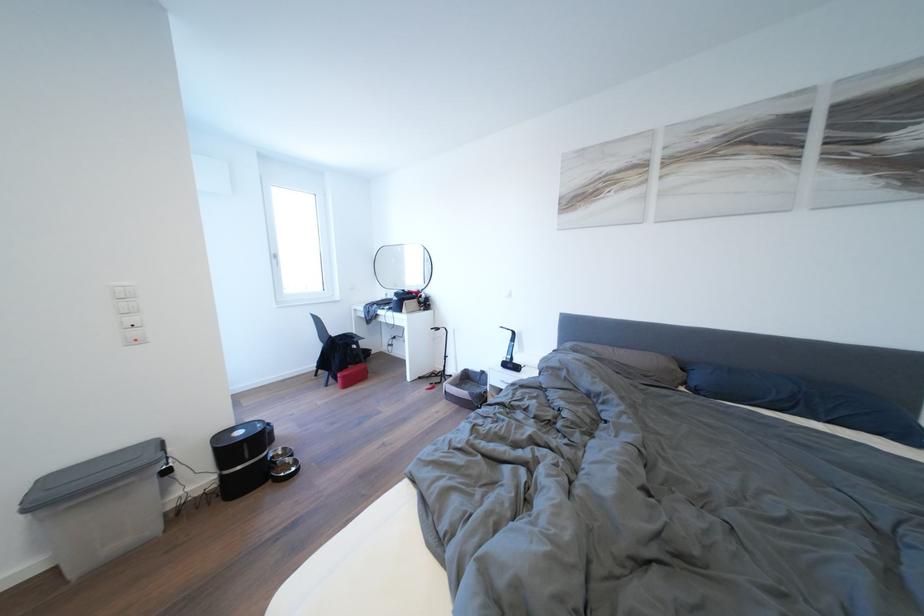
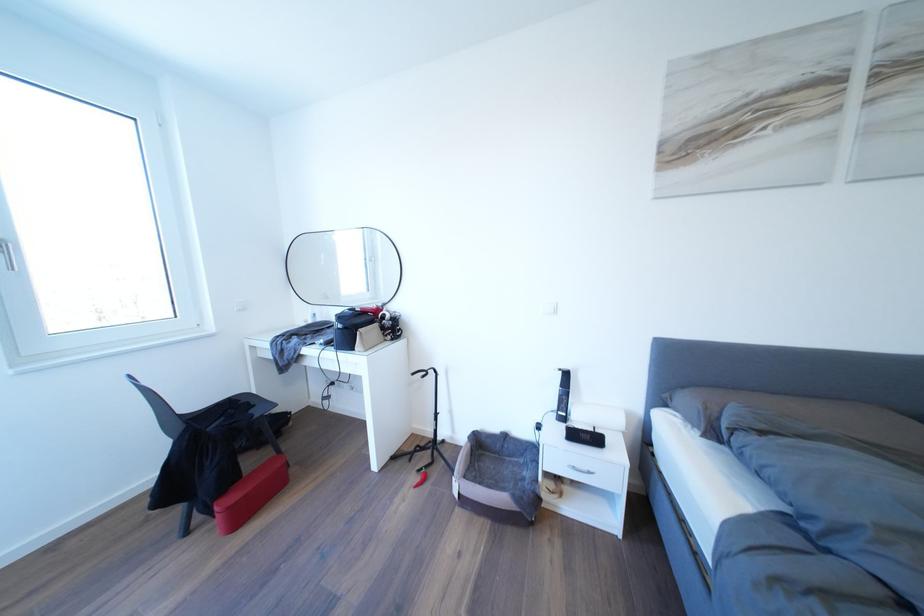
Locate, in the second image, the point that corresponds to point 344,383 in the first image.

(217, 519)